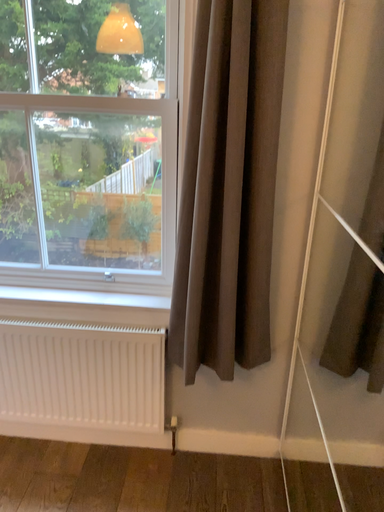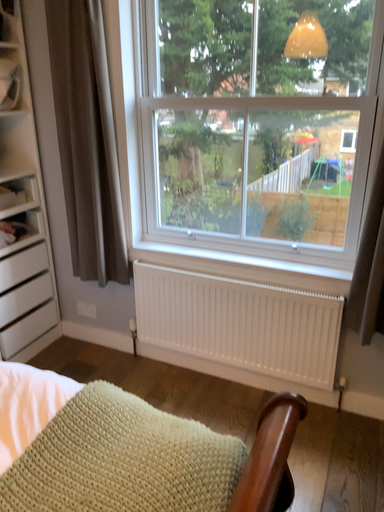
Question: How did the camera likely rotate when shooting the video?

Choices:
 (A) rotated left
 (B) rotated right

Answer: (A)